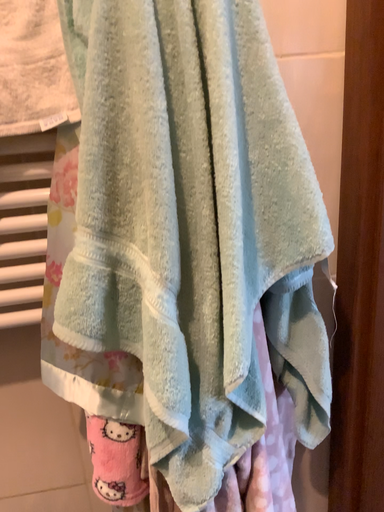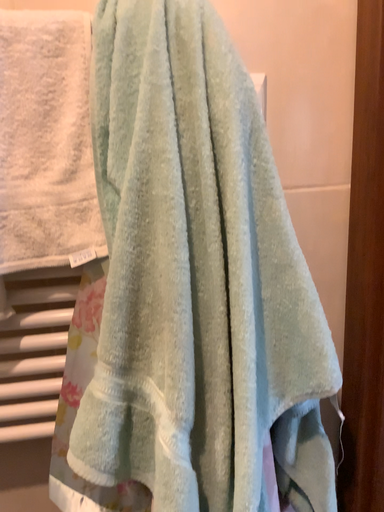
Question: Which way did the camera rotate in the video?

Choices:
 (A) rotated upward
 (B) rotated downward

Answer: (A)